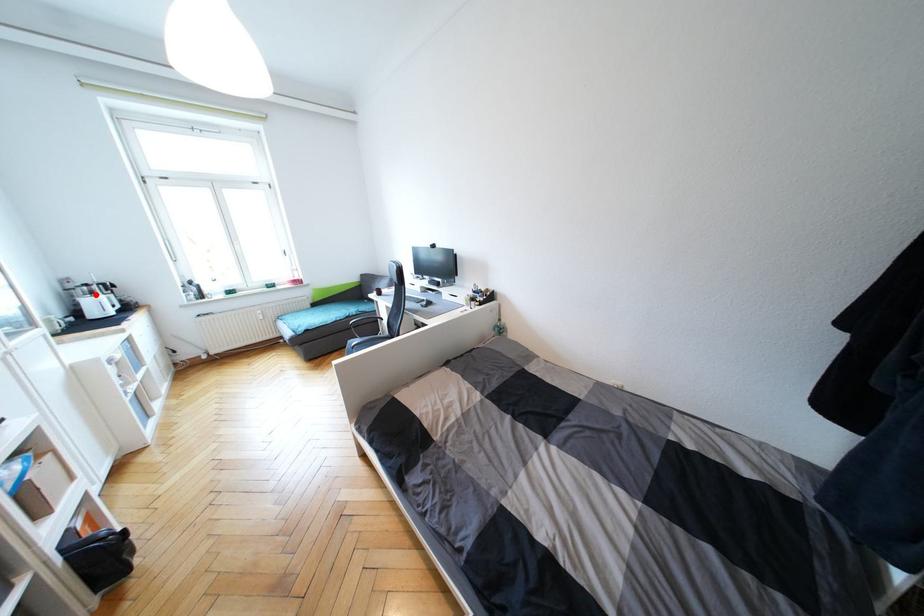
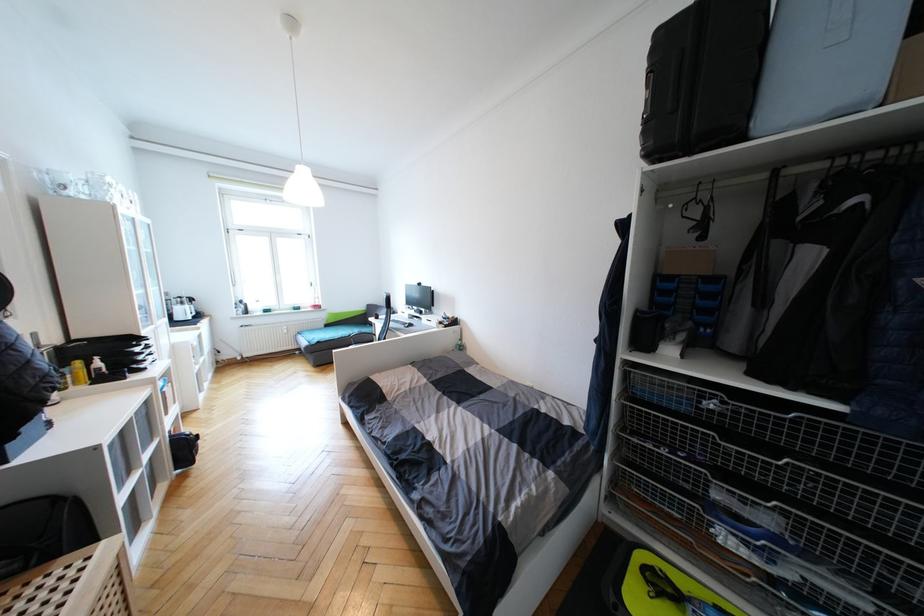
The point at the highlighted location is marked in the first image. Where is the corresponding point in the second image?

(186, 305)